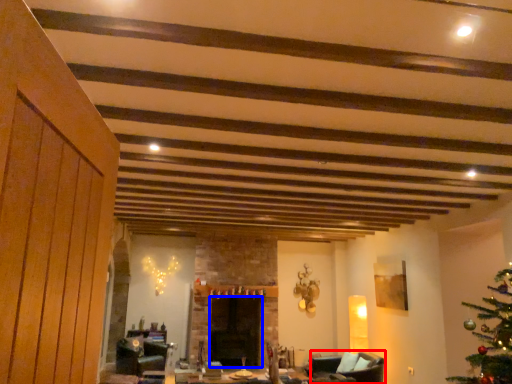
Question: Which of the following is the closest to the observer, armchair (highlighted by a red box) or fireplace (highlighted by a blue box)?

Choices:
 (A) armchair
 (B) fireplace

Answer: (A)